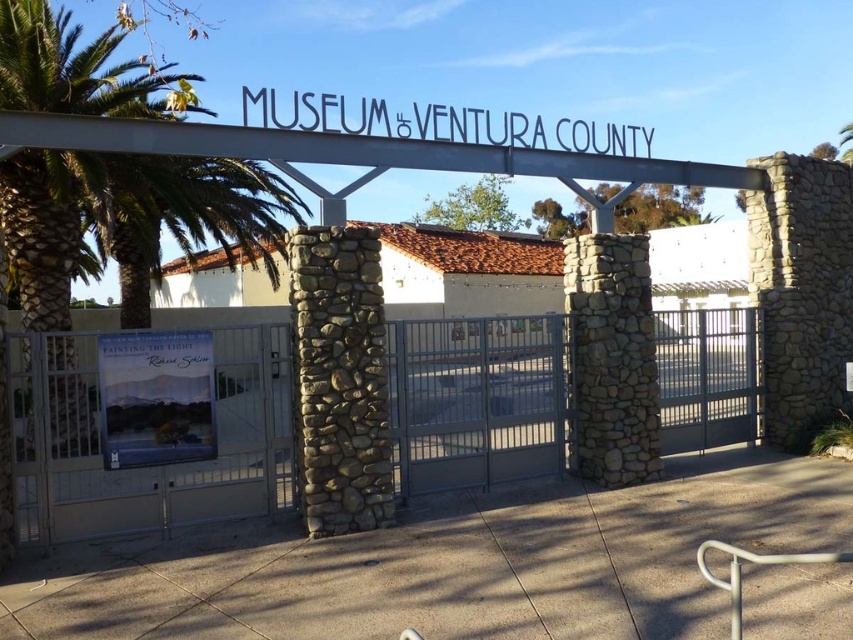
Between matte paper poster at center and white metal sign at center, which one is positioned lower?

matte paper poster at center

Who is more distant from viewer, (169, 364) or (625, 147)?

Point (625, 147)

Where is `matte paper poster at center`? The image size is (853, 640). matte paper poster at center is located at coordinates (155, 397).

This screenshot has height=640, width=853. Describe the element at coordinates (152, 467) in the screenshot. I see `metallic gray fence at center` at that location.

Who is shorter, metallic gray fence at center or matte paper poster at center?

With less height is matte paper poster at center.

You are a GUI agent. You are given a task and a screenshot of the screen. Output one action in this format:
    pyautogui.click(x=<x>, y=<y>)
    Task: Click on the metallic gray fence at center
    The height and width of the screenshot is (640, 853).
    Given the screenshot: What is the action you would take?
    pyautogui.click(x=152, y=467)

The width and height of the screenshot is (853, 640). What are the coordinates of `metallic gray fence at center` in the screenshot? It's located at (152, 467).

Does point (511, 432) lie in front of point (624, 138)?

Yes, point (511, 432) is closer to viewer.

Which is more to the right, metallic gray fence at center or white metal sign at center?

Positioned to the right is white metal sign at center.

What do you see at coordinates (152, 467) in the screenshot? The width and height of the screenshot is (853, 640). I see `metallic gray fence at center` at bounding box center [152, 467].

Where is `metallic gray fence at center`? This screenshot has width=853, height=640. metallic gray fence at center is located at coordinates (152, 467).